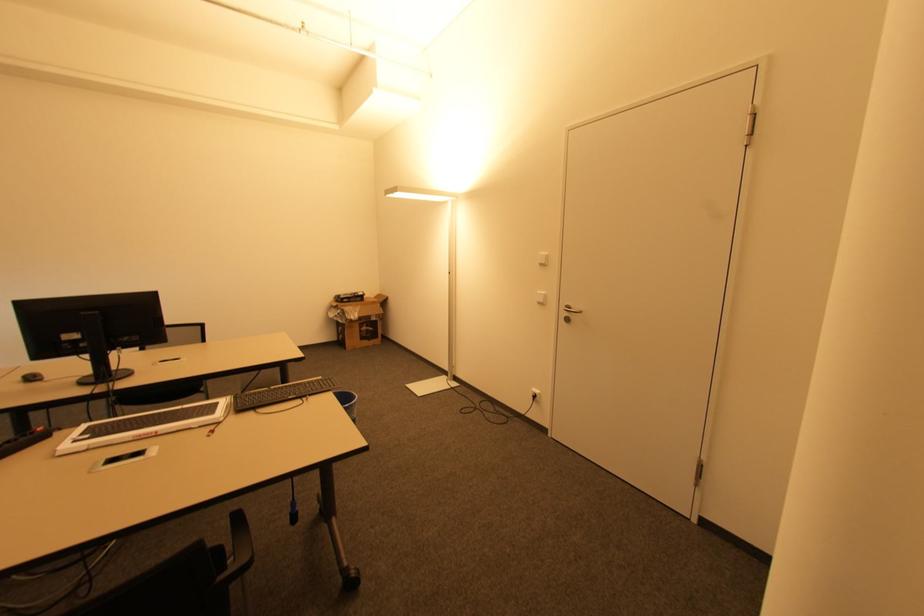
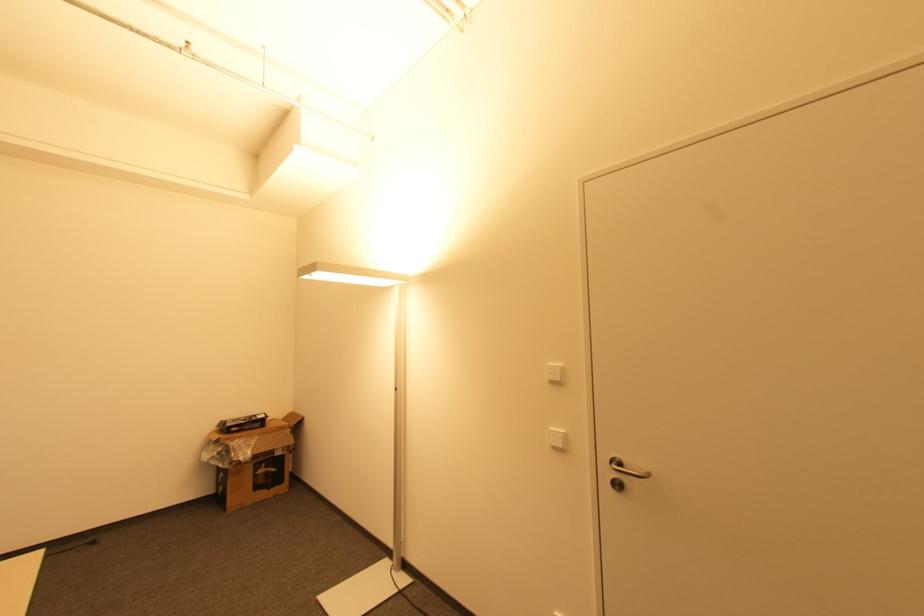
Where in the second image is the point corresponding to the point at 542,265 from the first image?

(554, 383)